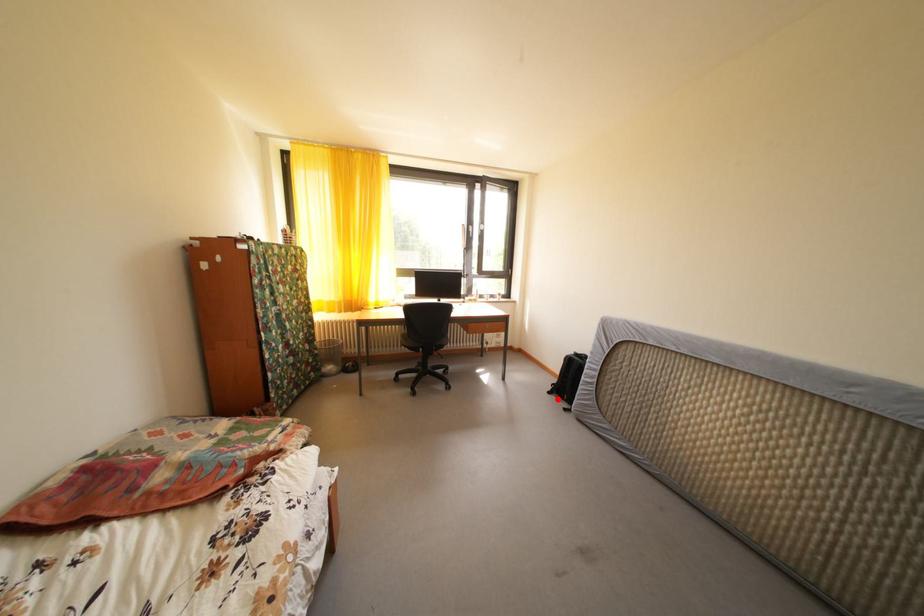
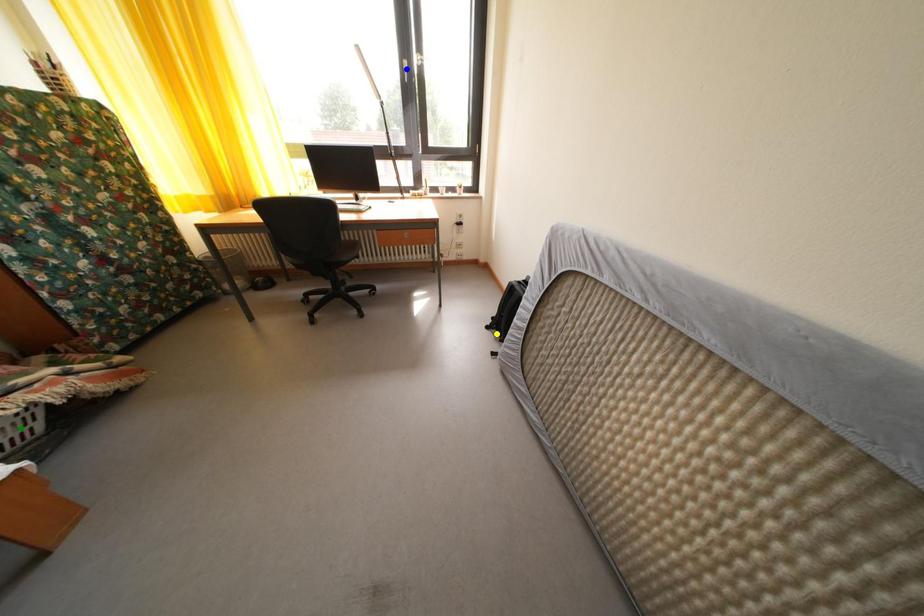
Question: I am providing you with two images of the same scene from different viewpoints. A red point is marked on the first image. You are given multiple points on the second image. Can you choose the point in image 2 that corresponds to the point in image 1?

Choices:
 (A) yellow point
 (B) green point
 (C) blue point

Answer: (A)